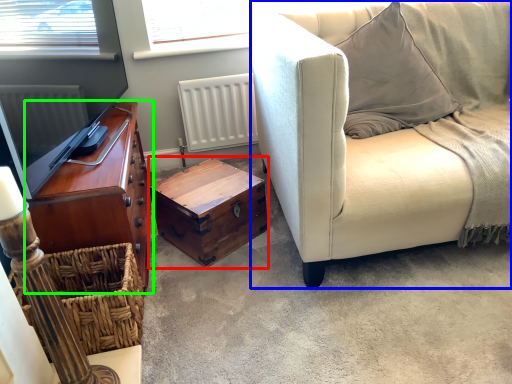
Question: Estimate the real-world distances between objects in this image. Which object is closer to chest (highlighted by a red box), studio couch (highlighted by a blue box) or cabinetry (highlighted by a green box)?

Choices:
 (A) studio couch
 (B) cabinetry

Answer: (B)